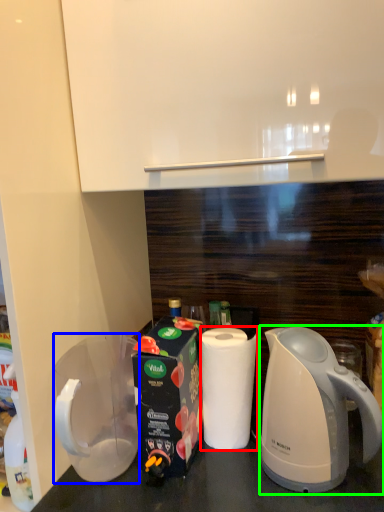
Question: Which is nearer to the paper towel (highlighted by a red box)? pitcher (highlighted by a blue box) or kettle (highlighted by a green box).

Choices:
 (A) pitcher
 (B) kettle

Answer: (B)